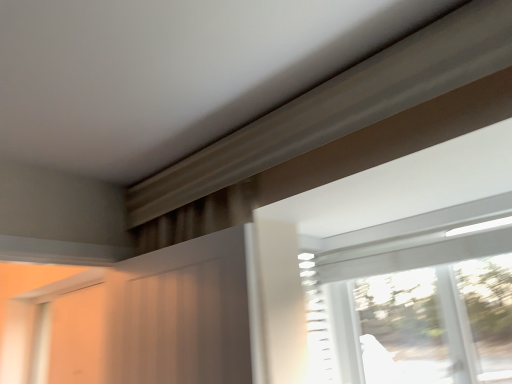
This screenshot has height=384, width=512. Describe the element at coordinates (183, 313) in the screenshot. I see `matte brown curtain at upper center` at that location.

The width and height of the screenshot is (512, 384). In order to click on matte brown curtain at upper center in this screenshot , I will do `click(183, 313)`.

Measure the distance between matte brown curtain at upper center and camera.

They are 1.33 meters apart.

Where is `matte brown curtain at upper center`? The image size is (512, 384). matte brown curtain at upper center is located at coordinates (183, 313).